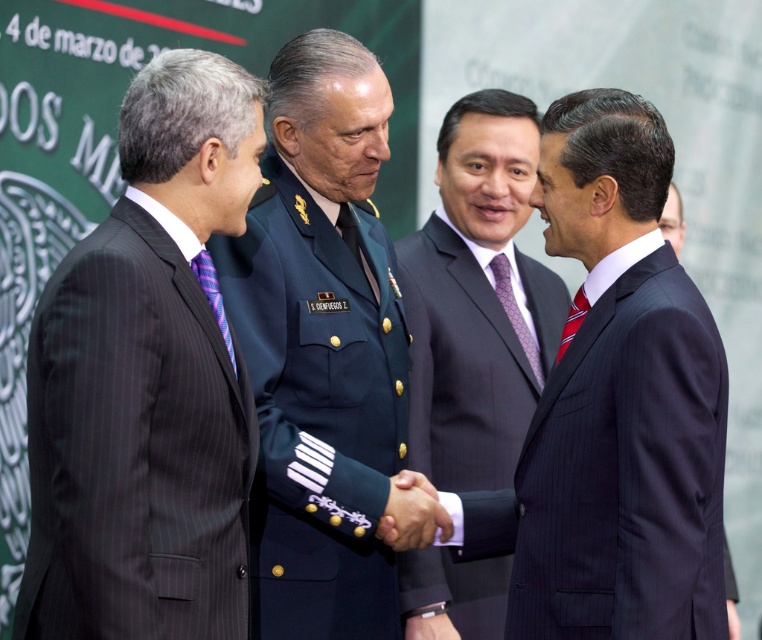
Question: Can you confirm if green military uniform at center is wider than black silk hand at center?

Choices:
 (A) no
 (B) yes

Answer: (B)

Question: Does purple textured tie at center appear on the right side of red silk tie at center?

Choices:
 (A) yes
 (B) no

Answer: (B)

Question: Estimate the real-world distances between objects in this image. Which object is farther from the purple textured tie at center?

Choices:
 (A) red silk tie at center
 (B) dark blue suit at center
 (C) black silk hand at center
 (D) green military uniform at center

Answer: (C)

Question: Which point is closer to the camera taking this photo?

Choices:
 (A) (536, 364)
 (B) (459, 136)
 (C) (572, 316)
 (D) (312, 132)

Answer: (C)

Question: Is dark blue suit at center wider than purple textured tie at center?

Choices:
 (A) no
 (B) yes

Answer: (B)

Question: Among these objects, which one is nearest to the camera?

Choices:
 (A) dark blue suit at center
 (B) purple striped tie at left

Answer: (B)